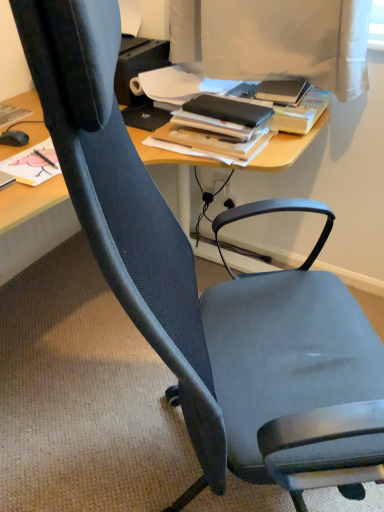
Question: Is matte black mouse at left placed right next to black matte book at center?

Choices:
 (A) yes
 (B) no

Answer: (B)

Question: Is black matte book at center at the back of matte black mouse at left?

Choices:
 (A) no
 (B) yes

Answer: (A)

Question: Does matte black mouse at left lie behind black matte book at center?

Choices:
 (A) yes
 (B) no

Answer: (A)

Question: From a real-world perspective, is matte black mouse at left located beneath black matte book at center?

Choices:
 (A) no
 (B) yes

Answer: (B)

Question: From the image's perspective, is matte black mouse at left over black matte book at center?

Choices:
 (A) yes
 (B) no

Answer: (B)

Question: From the image's perspective, is matte black mouse at left located beneath black matte book at center?

Choices:
 (A) no
 (B) yes

Answer: (B)

Question: Is black matte book at center smaller than matte black mouse at left?

Choices:
 (A) yes
 (B) no

Answer: (B)

Question: Is black matte book at center thinner than matte black mouse at left?

Choices:
 (A) yes
 (B) no

Answer: (B)

Question: Is black matte book at center looking in the opposite direction of matte black mouse at left?

Choices:
 (A) no
 (B) yes

Answer: (A)

Question: From the image's perspective, does black matte book at center appear higher than matte black mouse at left?

Choices:
 (A) no
 (B) yes

Answer: (B)

Question: Is matte black mouse at left a part of black matte book at center?

Choices:
 (A) no
 (B) yes

Answer: (A)

Question: Can you confirm if black matte book at center is taller than matte black mouse at left?

Choices:
 (A) no
 (B) yes

Answer: (B)

Question: In the image, is black matte book at center positioned in front of or behind matte black mouse at left?

Choices:
 (A) front
 (B) behind

Answer: (A)